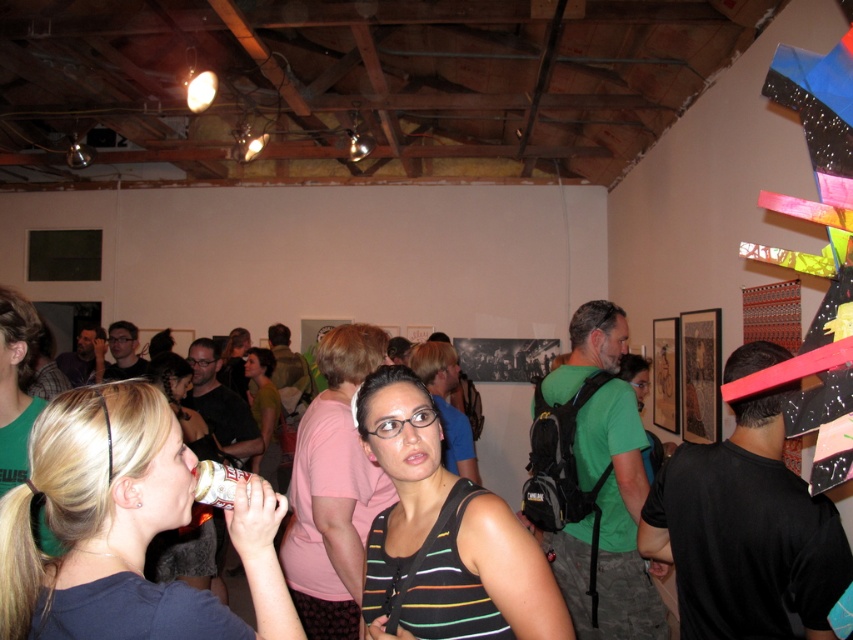
Question: Does dark blue fabric at center appear over black striped tank top at center?

Choices:
 (A) yes
 (B) no

Answer: (A)

Question: Which of the following is the closest to the observer?

Choices:
 (A) black striped tank top at center
 (B) dark blue fabric at center
 (C) matte green shirt at center

Answer: (B)

Question: Which of these objects is positioned farthest from the black striped tank top at center?

Choices:
 (A) dark blue fabric at center
 (B) matte green shirt at center

Answer: (B)

Question: Which point appears farthest from the camera in this image?

Choices:
 (A) (462, 573)
 (B) (160, 497)
 (C) (212, 529)
 (D) (268, 422)

Answer: (D)

Question: Where is dark blue fabric at center located in relation to white matte cup at center in the image?

Choices:
 (A) left
 (B) right

Answer: (B)

Question: Considering the relative positions of dark blue fabric at center and white matte cup at center in the image provided, where is dark blue fabric at center located with respect to white matte cup at center?

Choices:
 (A) above
 (B) below

Answer: (A)